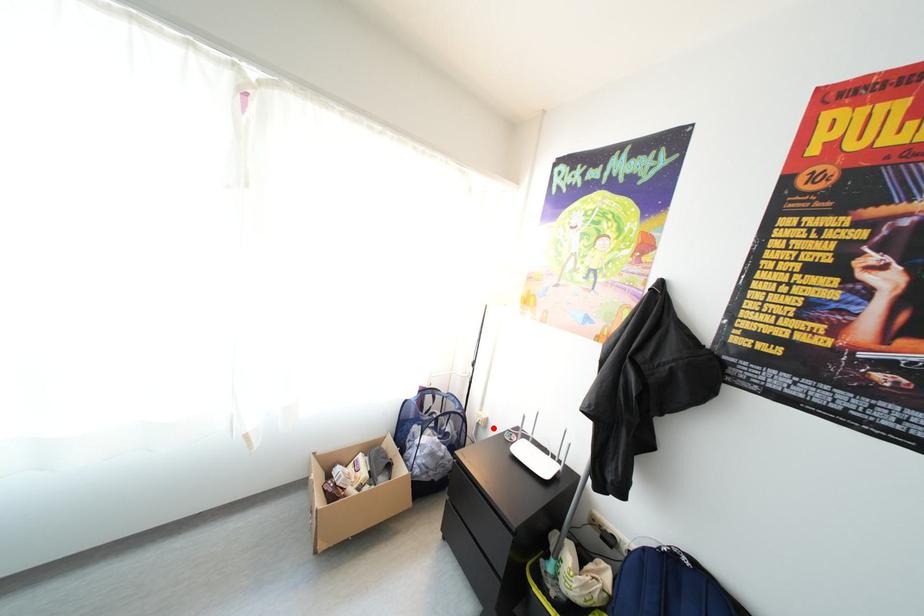
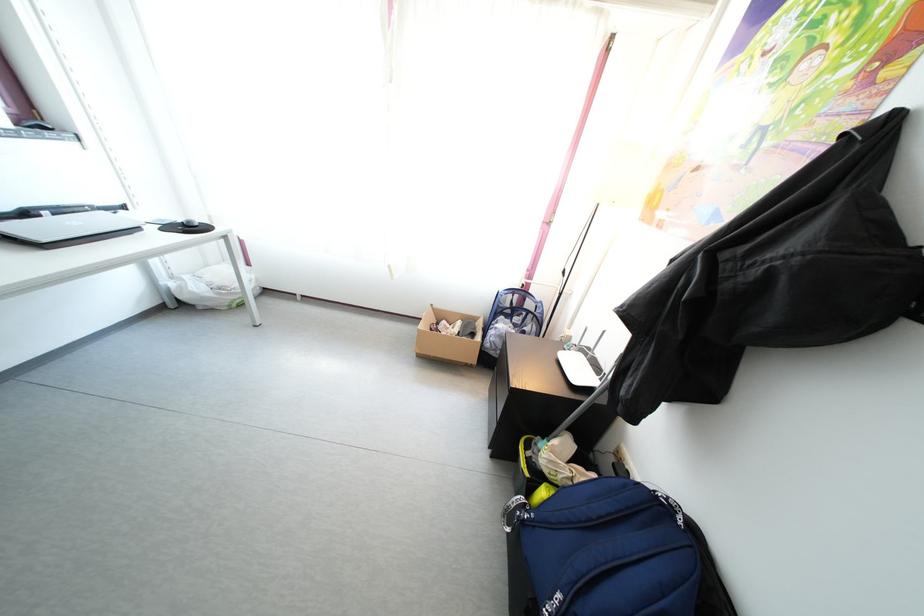
Where in the second image is the point corresponding to the highlighted location from the first image?

(576, 346)